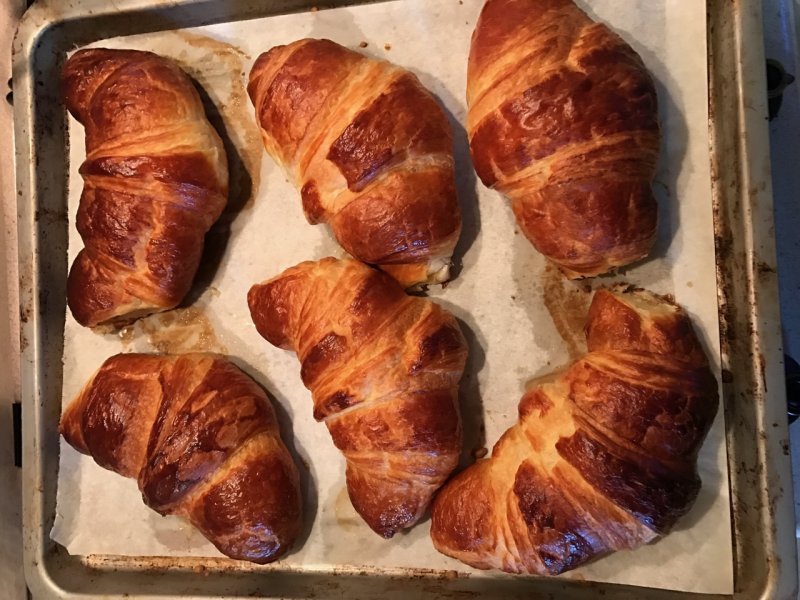
Find the location of a particular element. The height and width of the screenshot is (600, 800). lip of baking tray is located at coordinates (29, 358).